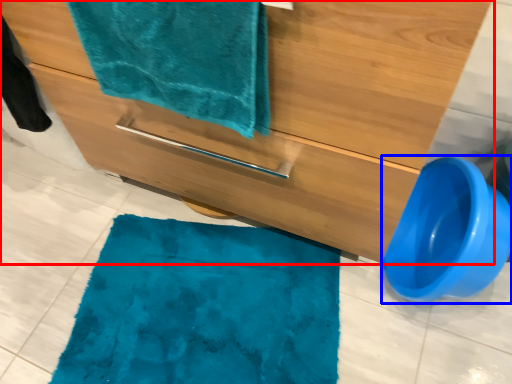
Question: Which object appears farthest to the camera in this image, bathroom cabinet (highlighted by a red box) or toilet bowl (highlighted by a blue box)?

Choices:
 (A) bathroom cabinet
 (B) toilet bowl

Answer: (B)